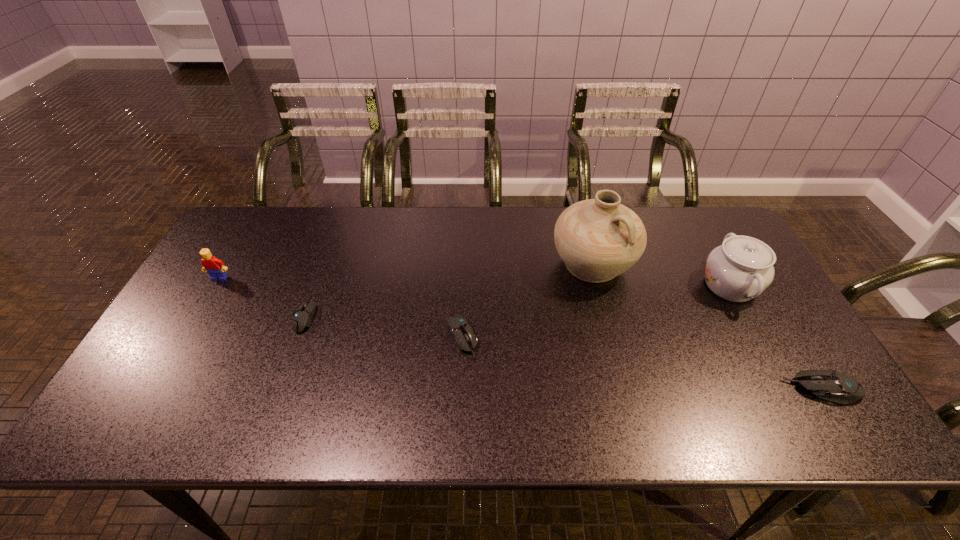
Locate an element on the screen. The height and width of the screenshot is (540, 960). free area in between the leftmost object and the rightmost computer mouse is located at coordinates (521, 334).

Identify the location of free area in between the third object from left to right and the tallest object. (527, 301).

You are a GUI agent. You are given a task and a screenshot of the screen. Output one action in this format:
    pyautogui.click(x=<x>, y=<y>)
    Task: Click on the vacant space that is in between the third object from left to right and the nearest computer mouse
    Image resolution: width=960 pixels, height=540 pixels.
    Given the screenshot: What is the action you would take?
    pyautogui.click(x=642, y=363)

The height and width of the screenshot is (540, 960). I want to click on vacant area between the leftmost computer mouse and the nearest object, so click(x=564, y=353).

The width and height of the screenshot is (960, 540). Find the location of `vacant area between the second object from left to right and the fifth shortest object`. vacant area between the second object from left to right and the fifth shortest object is located at coordinates click(517, 301).

Where is `empty space that is in between the fourth shortest object and the second shortest computer mouse`? This screenshot has width=960, height=540. empty space that is in between the fourth shortest object and the second shortest computer mouse is located at coordinates (341, 308).

I want to click on unoccupied area between the second tallest object and the tallest object, so point(661,275).

Find the location of a particular element. Image resolution: width=960 pixels, height=540 pixels. free space between the fifth tallest object and the nearest object is located at coordinates (642, 363).

Select which object appears as the third closest to the second tallest object. Please provide its 2D coordinates. Your answer should be formatted as a tuple, i.e. [(x, y)], where the tuple contains the x and y coordinates of a point satisfying the conditions above.

[(459, 328)]

Identify which object is located as the second nearest to the tallest object. Please provide its 2D coordinates. Your answer should be formatted as a tuple, i.e. [(x, y)], where the tuple contains the x and y coordinates of a point satisfying the conditions above.

[(459, 328)]